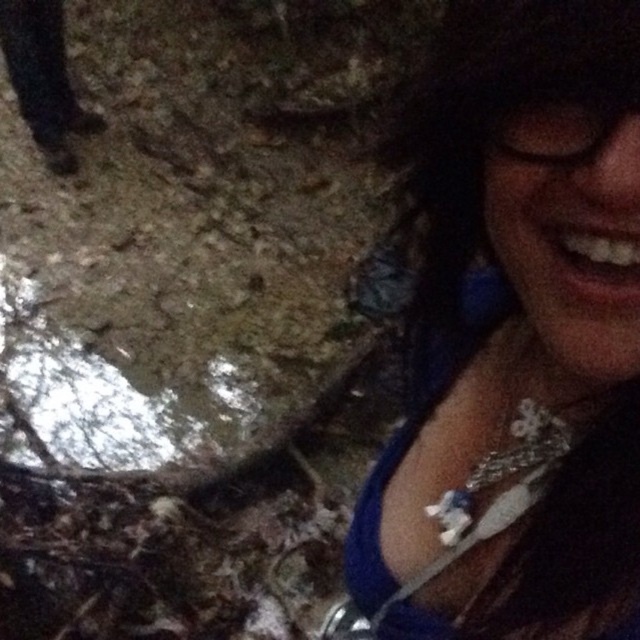
Is blue fabric necklace at upper right wider than transparent plastic goggles at upper right?

Indeed, blue fabric necklace at upper right has a greater width compared to transparent plastic goggles at upper right.

Does blue fabric necklace at upper right appear on the right side of transparent plastic goggles at upper right?

In fact, blue fabric necklace at upper right is to the left of transparent plastic goggles at upper right.

Between point (488, 419) and point (522, 90), which one is positioned behind?

The point (488, 419) is more distant.

At what (x,y) coordinates should I click in order to perform the action: click on blue fabric necklace at upper right. Please return your answer as a coordinate pair (x, y). This screenshot has height=640, width=640. Looking at the image, I should click on (515, 342).